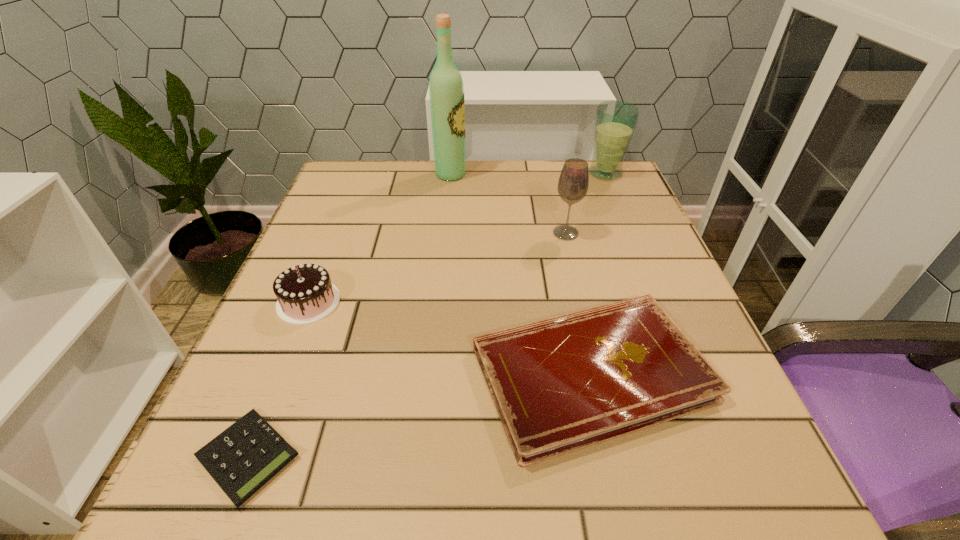
Find the location of `free area in between the calculator and the fourth nearest object`. free area in between the calculator and the fourth nearest object is located at coordinates (407, 345).

In order to click on vacant space that's between the third farthest object and the shortest object in this screenshot , I will do `click(407, 345)`.

This screenshot has width=960, height=540. I want to click on free point between the wine bottle and the second shortest object, so click(521, 274).

Find the location of a particular element. Image resolution: width=960 pixels, height=540 pixels. free space that is in between the calculator and the right glass drink container is located at coordinates (426, 315).

This screenshot has height=540, width=960. What are the coordinates of `empty space between the farther glass drink container and the nearer glass drink container` in the screenshot? It's located at (586, 203).

I want to click on vacant space that is in between the third shortest object and the farther glass drink container, so click(x=457, y=238).

The width and height of the screenshot is (960, 540). I want to click on unoccupied position between the shortest object and the chocolate cake, so click(278, 380).

Locate an element on the screen. The width and height of the screenshot is (960, 540). vacant space in between the right glass drink container and the wine bottle is located at coordinates (528, 174).

Identify the location of free spot between the wine bottle and the notebook. (521, 274).

Locate which object ranks fifth in proximity to the chocolate cake. Please provide its 2D coordinates. Your answer should be formatted as a tuple, i.e. [(x, y)], where the tuple contains the x and y coordinates of a point satisfying the conditions above.

[(615, 121)]